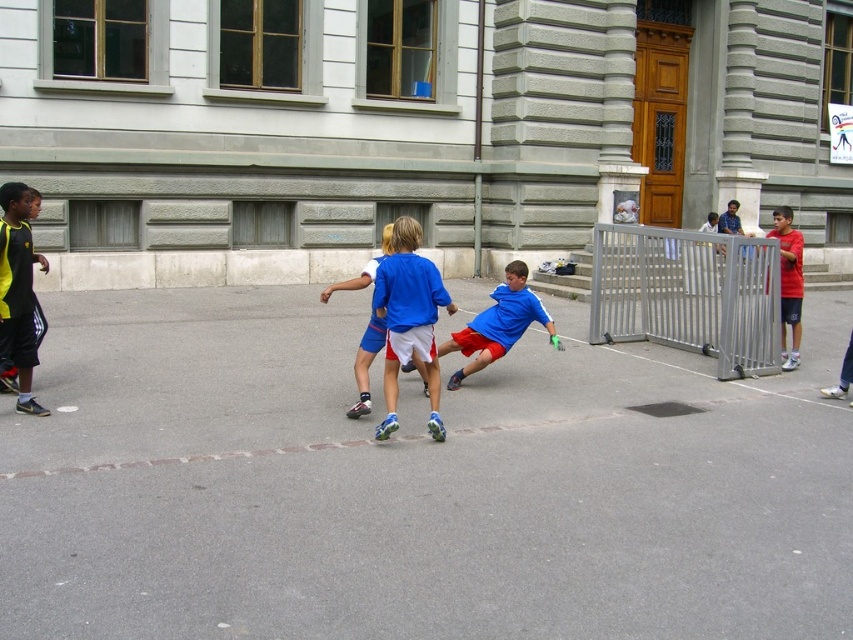
Who is higher up, yellow-green jersey at left or blue fabric shorts at center?

yellow-green jersey at left is above.

Can you confirm if yellow-green jersey at left is positioned above blue fabric shorts at center?

Yes, yellow-green jersey at left is above blue fabric shorts at center.

Describe the element at coordinates (18, 291) in the screenshot. I see `yellow-green jersey at left` at that location.

You are a GUI agent. You are given a task and a screenshot of the screen. Output one action in this format:
    pyautogui.click(x=<x>, y=<y>)
    Task: Click on the yellow-green jersey at left
    The image size is (853, 640).
    Given the screenshot: What is the action you would take?
    pyautogui.click(x=18, y=291)

Is red shirt at right above blue fabric shorts at center?

Yes.

Can you confirm if red shirt at right is thinner than blue fabric shorts at center?

No.

Between point (793, 244) and point (363, 353), which one is positioned behind?

The point (793, 244) is behind.

Locate an element on the screen. The image size is (853, 640). red shirt at right is located at coordinates (788, 282).

Is point (387, 369) positioned after point (375, 257)?

No, (387, 369) is closer to viewer.

Is blue matte shorts at center above blue fabric shorts at center?

Indeed, blue matte shorts at center is positioned over blue fabric shorts at center.

Is point (398, 241) closer to camera compared to point (373, 317)?

That is True.

Find the location of a particular element. This screenshot has width=853, height=640. blue matte shorts at center is located at coordinates (409, 321).